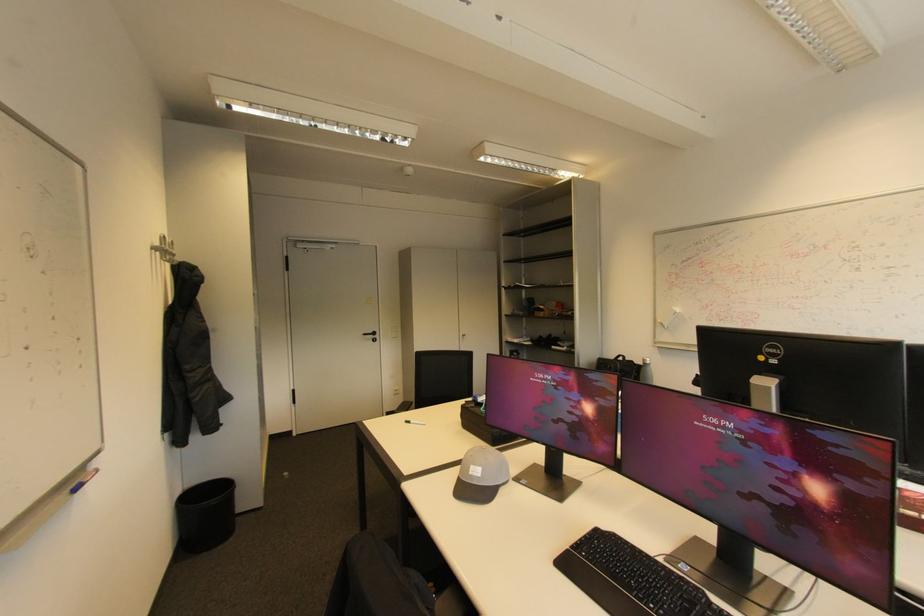
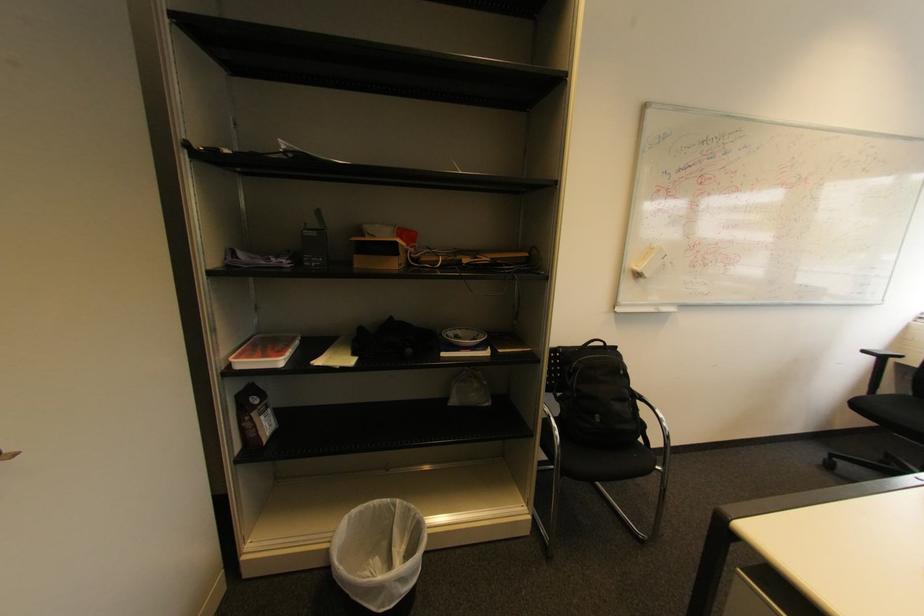
Question: I am providing you with two images of the same scene from different viewpoints. Please identify which objects are invisible in image2.

Choices:
 (A) black chair sitting surface
 (B) whiteboard eraser
 (C) black chair armrest
 (D) none of these

Answer: (D)